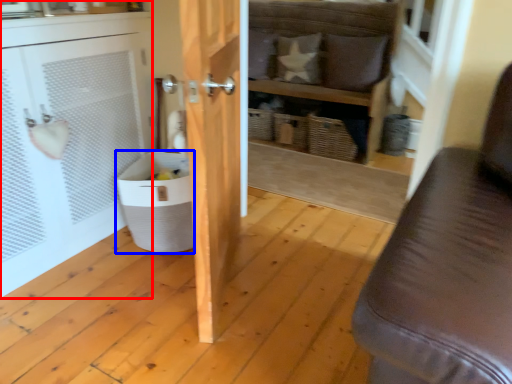
Question: Which object is closer to the camera taking this photo, cabinetry (highlighted by a red box) or laundry basket (highlighted by a blue box)?

Choices:
 (A) cabinetry
 (B) laundry basket

Answer: (A)